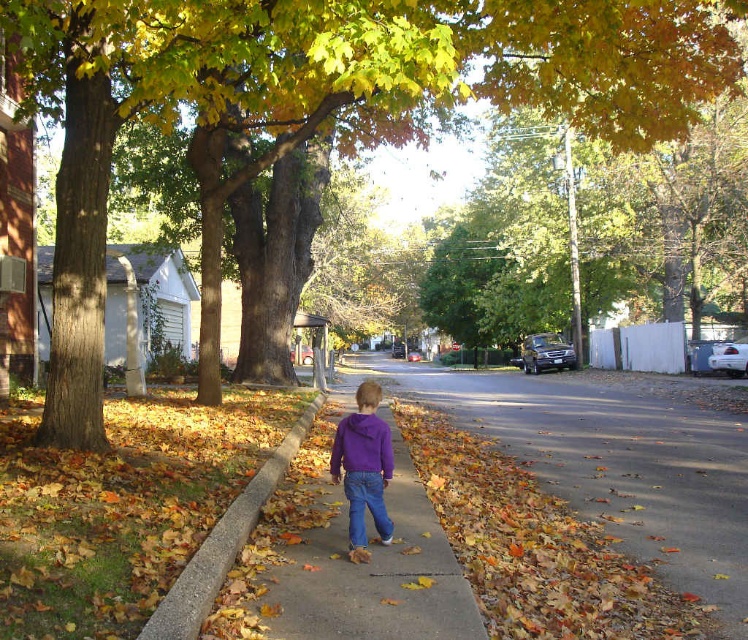
You are standing on the sidewalk in the scene and want to walk towards the point that is closer to you. Which point should you head towards, point (187, 570) or point (373, 428)?

You should head towards point (187, 570) because it is closer to the viewer than point (373, 428).

You are designing a new sidewalk and need to know the relative widths of the existing concrete at lower left and the purple fleece jacket at center. Which one is narrower?

The concrete at lower left has a lesser width compared to the purple fleece jacket at center, so the concrete at lower left is narrower.